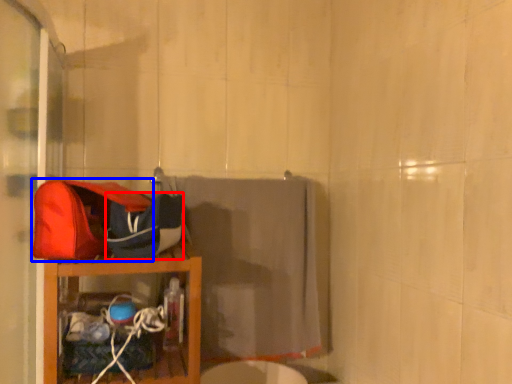
Question: Which of the following is the farthest to the observer, kit (highlighted by a red box) or shoulder bag (highlighted by a blue box)?

Choices:
 (A) kit
 (B) shoulder bag

Answer: (A)